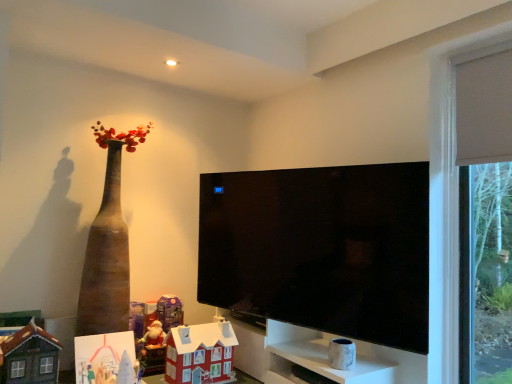
Question: Considering the relative sizes of black glossy tv at center and white marble vase at lower center, which is counted as the 6th toy, starting from the left, in the image provided, is black glossy tv at center taller than white marble vase at lower center, which is counted as the 6th toy, starting from the left,?

Choices:
 (A) yes
 (B) no

Answer: (A)

Question: From a real-world perspective, does black glossy tv at center stand above white marble vase at lower center, which is counted as the 6th toy, starting from the left?

Choices:
 (A) yes
 (B) no

Answer: (A)

Question: From the image's perspective, is black glossy tv at center under white marble vase at lower center, which is counted as the 6th toy, starting from the left?

Choices:
 (A) no
 (B) yes

Answer: (A)

Question: Is black glossy tv at center aimed at white marble vase at lower center, which is counted as the 6th toy, starting from the left?

Choices:
 (A) yes
 (B) no

Answer: (B)

Question: Can you confirm if black glossy tv at center is bigger than white marble vase at lower center, which ranks as the first toy in right-to-left order?

Choices:
 (A) yes
 (B) no

Answer: (A)

Question: Is black glossy tv at center at the right side of white marble vase at lower center, which is counted as the 6th toy, starting from the left?

Choices:
 (A) yes
 (B) no

Answer: (B)

Question: Is white marble cabinet at lower right at the right side of black glossy tv at center?

Choices:
 (A) yes
 (B) no

Answer: (A)

Question: Is white marble cabinet at lower right far away from black glossy tv at center?

Choices:
 (A) yes
 (B) no

Answer: (B)

Question: Is white marble cabinet at lower right smaller than black glossy tv at center?

Choices:
 (A) yes
 (B) no

Answer: (A)

Question: Is white marble cabinet at lower right in front of black glossy tv at center?

Choices:
 (A) no
 (B) yes

Answer: (A)

Question: Is white marble cabinet at lower right aimed at black glossy tv at center?

Choices:
 (A) yes
 (B) no

Answer: (B)

Question: Is white marble cabinet at lower right bigger than black glossy tv at center?

Choices:
 (A) no
 (B) yes

Answer: (A)

Question: Can you confirm if matte purple toy at lower center, the fourth toy in the left-to-right sequence, is smaller than white marble cabinet at lower right?

Choices:
 (A) yes
 (B) no

Answer: (A)